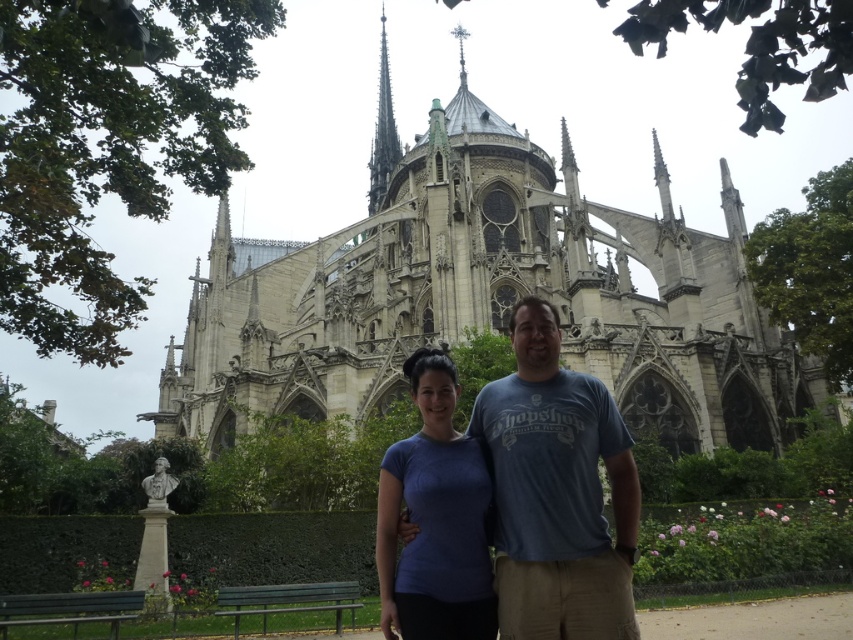
You are a photographer standing in front of the stone gothic cathedral at center and the gray stone spire at upper center. You want to take a photo where both objects are clearly visible. Which object should you focus on to ensure both are in sharp focus?

You should focus on the stone gothic cathedral at center because it is closer to the viewer than the gray stone spire at upper center, so focusing on the closer object will keep both in focus.

You are a tourist standing in front of the cathedral and notice the blue cotton shirt at center and the gray stone spire at upper center. Which object is closer to the ground?

The blue cotton shirt at center is shorter than the gray stone spire at upper center, so it is closer to the ground.